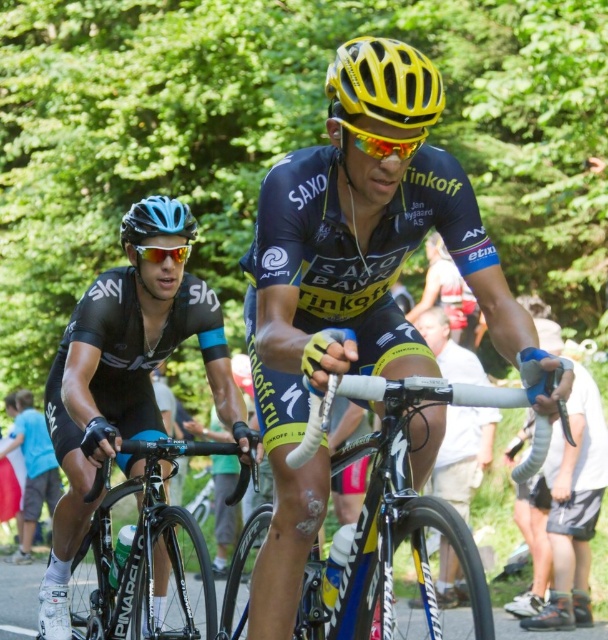
In the scene shown: Does matte black jersey at center lie behind shiny black frame at center?

Yes, matte black jersey at center is further from the viewer.

Which is more to the right, matte black jersey at center or shiny black frame at center?

From the viewer's perspective, shiny black frame at center appears more on the right side.

Is point (277, 234) farther from viewer compared to point (517, 406)?

Yes, it is.

I want to click on matte black jersey at center, so click(358, 285).

Is matte black jersey at center shorter than black matte bicycle at center?

Incorrect, matte black jersey at center's height does not fall short of black matte bicycle at center's.

Is point (340, 275) less distant than point (46, 611)?

Yes, it is in front of point (46, 611).

In order to click on matte black jersey at center in this screenshot , I will do `click(358, 285)`.

Which is more to the right, black matte cycling jersey at left or yellow matte bicycle helmet at upper center?

yellow matte bicycle helmet at upper center

Is black matte cycling jersey at left wider than yellow matte bicycle helmet at upper center?

Yes.

Image resolution: width=608 pixels, height=640 pixels. In order to click on black matte cycling jersey at left in this screenshot , I will do `click(122, 392)`.